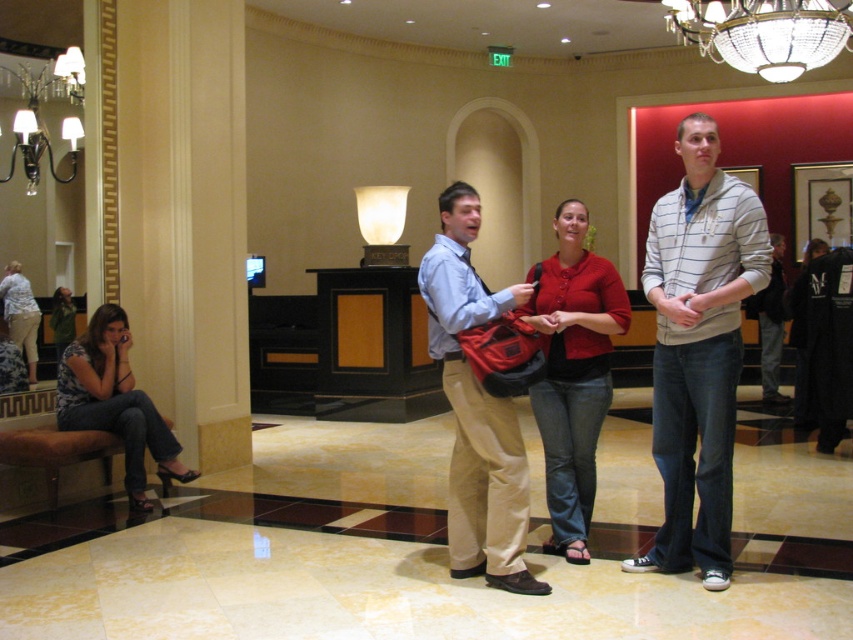
Which of these two, crystal glass chandelier at upper center or matte silver chandelier at upper left, stands shorter?

matte silver chandelier at upper left is shorter.

Is point (814, 42) in front of point (74, 84)?

No.

Locate an element on the screen. crystal glass chandelier at upper center is located at coordinates (763, 33).

Between matte blue shirt at center and crystal glass chandelier at upper center, which one is positioned lower?

Positioned lower is matte blue shirt at center.

Between point (473, 240) and point (788, 38), which one is positioned behind?

Point (788, 38)

Which is in front, point (465, 499) or point (676, 12)?

Point (465, 499)

Identify the location of matte blue shirt at center. This screenshot has height=640, width=853. (476, 408).

Who is more forward, (656,320) or (547,403)?

Point (547,403) is more forward.

The height and width of the screenshot is (640, 853). I want to click on striped cotton hoodie at center, so click(698, 348).